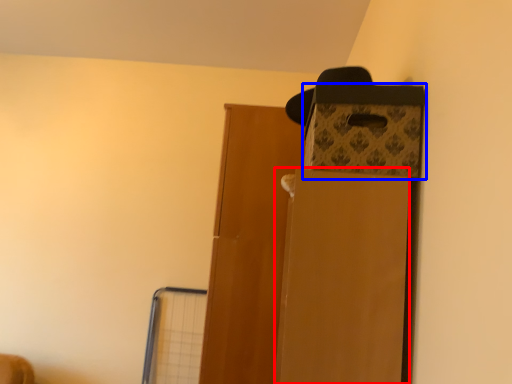
Question: Which point is closer to the camera, cardboard box (highlighted by a red box) or storage box (highlighted by a blue box)?

Choices:
 (A) cardboard box
 (B) storage box

Answer: (A)